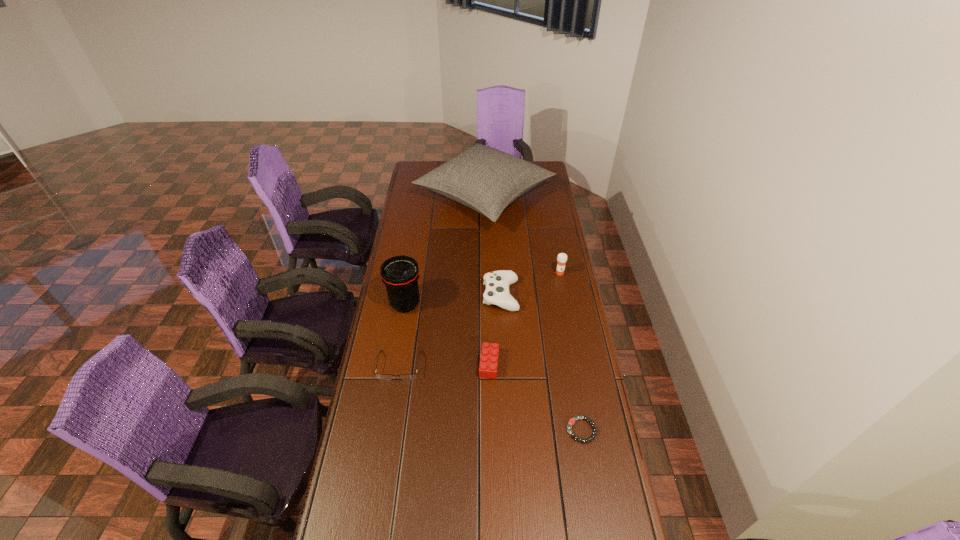
Find the location of a particular element. The height and width of the screenshot is (540, 960). the farthest object is located at coordinates (487, 180).

Where is `telephoto lens`? Image resolution: width=960 pixels, height=540 pixels. telephoto lens is located at coordinates (400, 274).

Identify the location of the second farthest object. This screenshot has width=960, height=540. (562, 257).

Identify the location of the fifth shortest object. This screenshot has width=960, height=540. (562, 257).

The height and width of the screenshot is (540, 960). What are the coordinates of `the fourth shortest object` in the screenshot? It's located at (497, 283).

What are the coordinates of `Lego` in the screenshot? It's located at (488, 365).

Where is `the sixth tallest object`? The image size is (960, 540). the sixth tallest object is located at coordinates (380, 376).

You are a GUI agent. You are given a task and a screenshot of the screen. Output one action in this format:
    pyautogui.click(x=<x>, y=<y>)
    Task: Click on the shortest object
    The image size is (960, 540).
    Given the screenshot: What is the action you would take?
    (571, 422)

At what (x,y) coordinates should I click in order to perform the action: click on bracelet. Please return your answer as a coordinate pair (x, y). This screenshot has height=540, width=960. Looking at the image, I should click on (571, 422).

Identify the location of free location located 0.210m on the front of the farthest object. (486, 272).